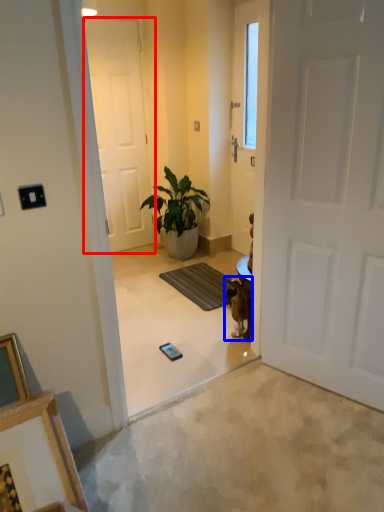
Question: Which of the following is the closest to the observer, door (highlighted by a red box) or animal (highlighted by a blue box)?

Choices:
 (A) door
 (B) animal

Answer: (B)